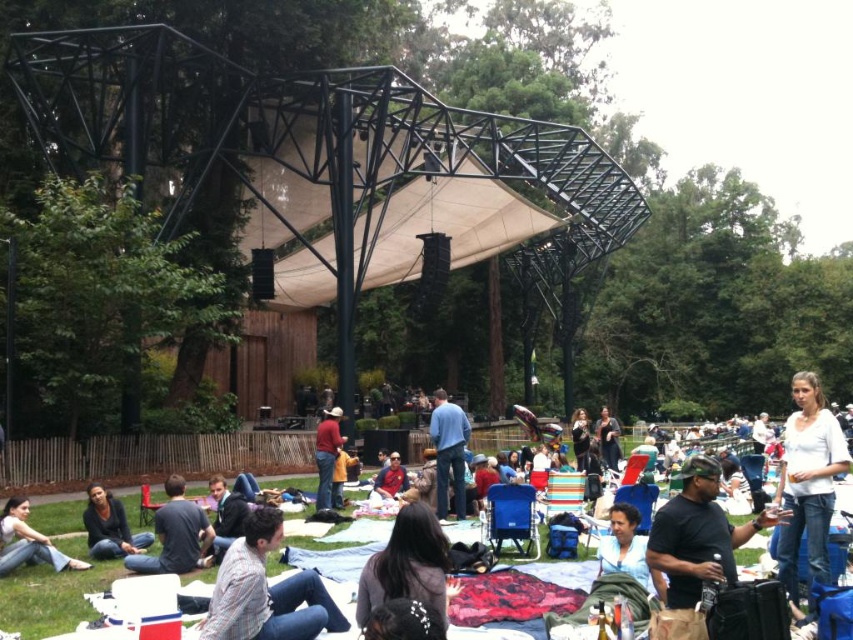
Question: In this image, where is white cotton shirt at center located relative to dark gray sweater at center?

Choices:
 (A) right
 (B) left

Answer: (B)

Question: Which of the following is the closest to the observer?

Choices:
 (A) (811, 524)
 (B) (6, 545)
 (C) (816, 476)
 (D) (439, 500)

Answer: (A)

Question: Which is nearer to the blue jeans at center?

Choices:
 (A) dark gray shirt at lower left
 (B) white matte shirt at center

Answer: (A)

Question: Observing the image, what is the correct spatial positioning of white cotton shirt at center in reference to dark gray sweater at center?

Choices:
 (A) right
 (B) left

Answer: (B)

Question: Which object appears closest to the camera in this image?

Choices:
 (A) dark gray jeans at lower left
 (B) plaid shirt at center

Answer: (B)

Question: Does dark gray shirt at lower left appear on the right side of dark gray jeans at lower left?

Choices:
 (A) no
 (B) yes

Answer: (B)